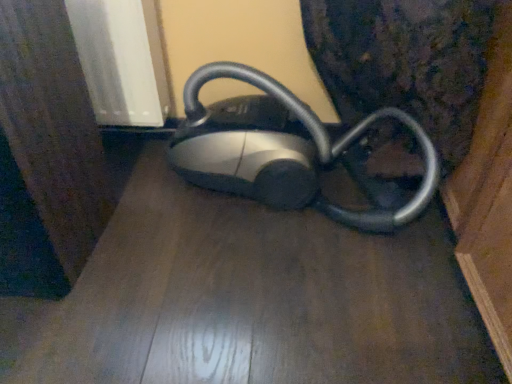
Question: Is silver metallic vacuum cleaner at center spatially inside matte black vacuum cleaner at center, or outside of it?

Choices:
 (A) outside
 (B) inside

Answer: (A)

Question: Is silver metallic vacuum cleaner at center bigger or smaller than matte black vacuum cleaner at center?

Choices:
 (A) big
 (B) small

Answer: (A)

Question: In terms of width, does silver metallic vacuum cleaner at center look wider or thinner when compared to matte black vacuum cleaner at center?

Choices:
 (A) wide
 (B) thin

Answer: (B)

Question: In the image, is matte black vacuum cleaner at center on the left side or the right side of silver metallic vacuum cleaner at center?

Choices:
 (A) right
 (B) left

Answer: (B)

Question: Is point (48, 309) closer or farther from the camera than point (265, 137)?

Choices:
 (A) closer
 (B) farther

Answer: (A)

Question: From a real-world perspective, is matte black vacuum cleaner at center positioned above or below silver metallic vacuum cleaner at center?

Choices:
 (A) below
 (B) above

Answer: (A)

Question: In terms of height, does matte black vacuum cleaner at center look taller or shorter compared to silver metallic vacuum cleaner at center?

Choices:
 (A) short
 (B) tall

Answer: (A)